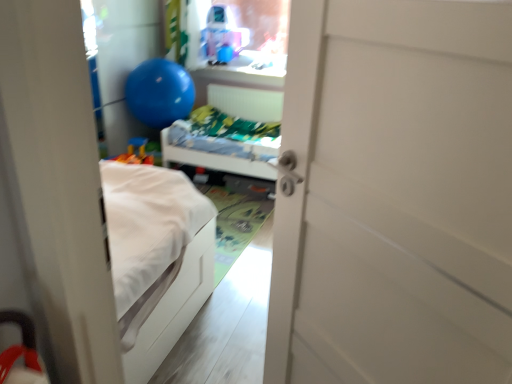
The image size is (512, 384). Find the location of `free space in front of translucent plastic toy at upper center`. free space in front of translucent plastic toy at upper center is located at coordinates pyautogui.click(x=226, y=69).